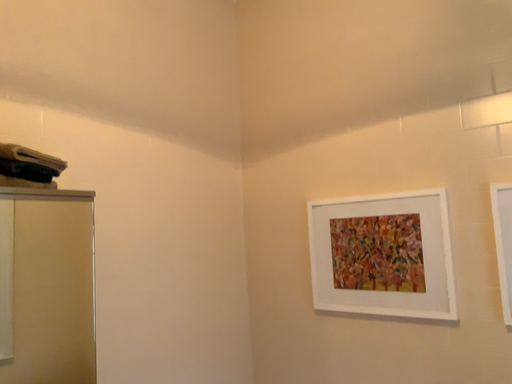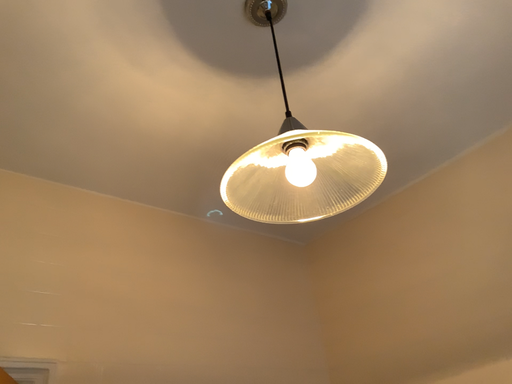
Question: How did the camera likely rotate when shooting the video?

Choices:
 (A) rotated downward
 (B) rotated upward

Answer: (B)